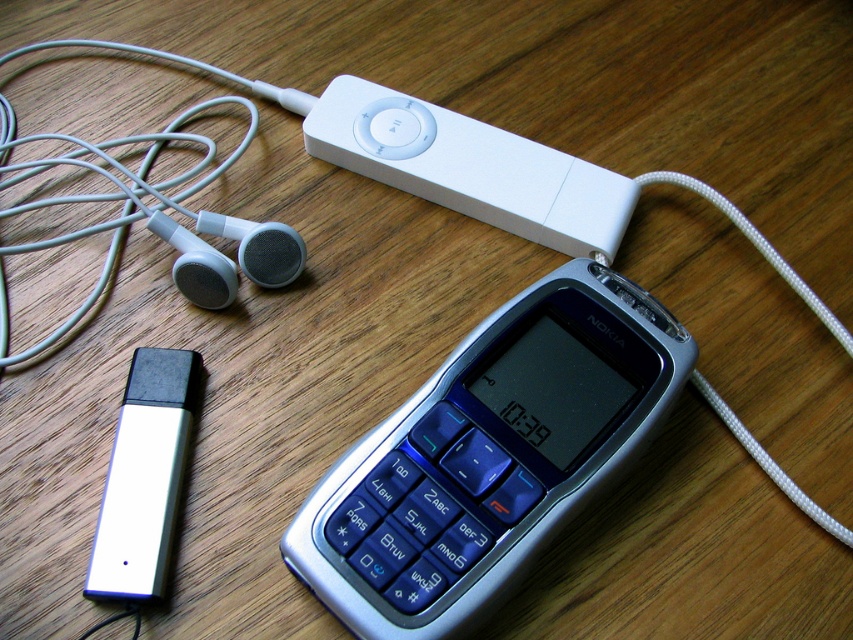
Measure the distance between silver metallic nokia phone at center and camera.

34.31 inches

In the scene shown: Can you confirm if silver metallic nokia phone at center is taller than satin black earphone at upper left?

Yes.

Between point (372, 584) and point (264, 228), which one is positioned in front?

Point (372, 584)

Locate an element on the screen. The height and width of the screenshot is (640, 853). silver metallic nokia phone at center is located at coordinates (490, 456).

Is white matte ipod at upper center positioned before satin black earphone at upper left?

No.

Can you confirm if white matte ipod at upper center is thinner than satin black earphone at upper left?

No, white matte ipod at upper center is not thinner than satin black earphone at upper left.

Is point (369, 86) behind point (250, 268)?

Yes, it is behind point (250, 268).

Find the location of a particular element. white matte ipod at upper center is located at coordinates (469, 168).

Is silver metallic nokia phone at center positioned before white matte earphone at upper left?

Yes, it is.

Which is more to the left, silver metallic nokia phone at center or white matte earphone at upper left?

From the viewer's perspective, white matte earphone at upper left appears more on the left side.

This screenshot has height=640, width=853. What do you see at coordinates (490, 456) in the screenshot? I see `silver metallic nokia phone at center` at bounding box center [490, 456].

Identify the location of silver metallic nokia phone at center. (490, 456).